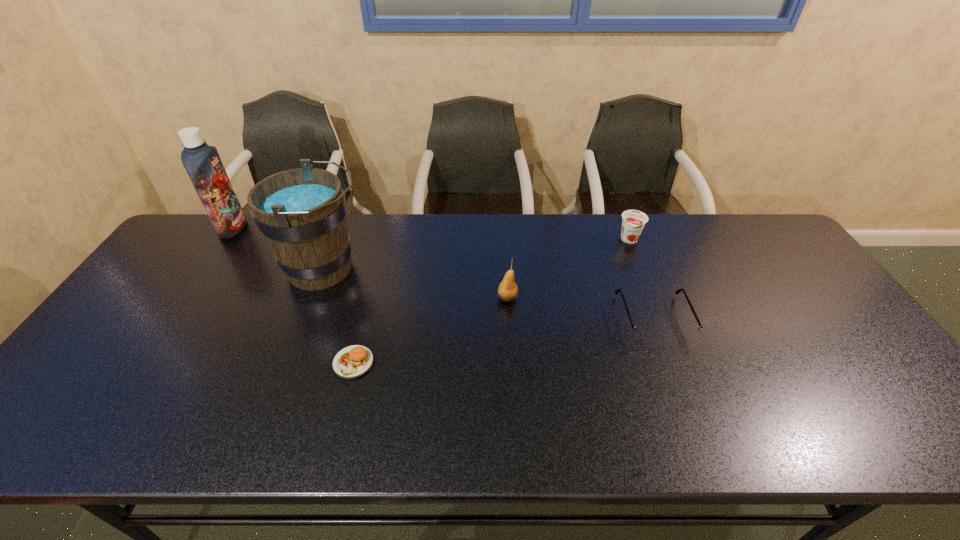
Identify the location of the leftmost object. (202, 162).

This screenshot has width=960, height=540. What are the coordinates of `wine bucket` in the screenshot? It's located at (301, 212).

Where is `pear`? pear is located at coordinates (508, 290).

Where is `the third tallest object`? This screenshot has width=960, height=540. the third tallest object is located at coordinates (508, 290).

What are the coordinates of `yogurt` in the screenshot? It's located at point(633,221).

This screenshot has width=960, height=540. I want to click on spectacles, so click(x=639, y=333).

Find the location of a particular element. patty is located at coordinates (353, 361).

This screenshot has width=960, height=540. I want to click on the nearest object, so click(353, 361).

This screenshot has width=960, height=540. In order to click on free space located on the front label of the leftmost object in this screenshot , I will do `click(266, 228)`.

Where is `vacant space situated with a handle on the side of the wine bucket`? The width and height of the screenshot is (960, 540). vacant space situated with a handle on the side of the wine bucket is located at coordinates (390, 269).